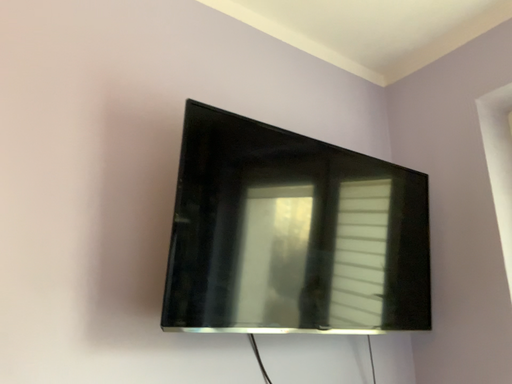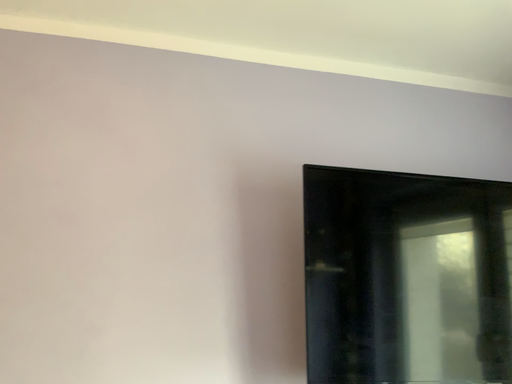
Question: Which way did the camera rotate in the video?

Choices:
 (A) rotated left
 (B) rotated right

Answer: (A)